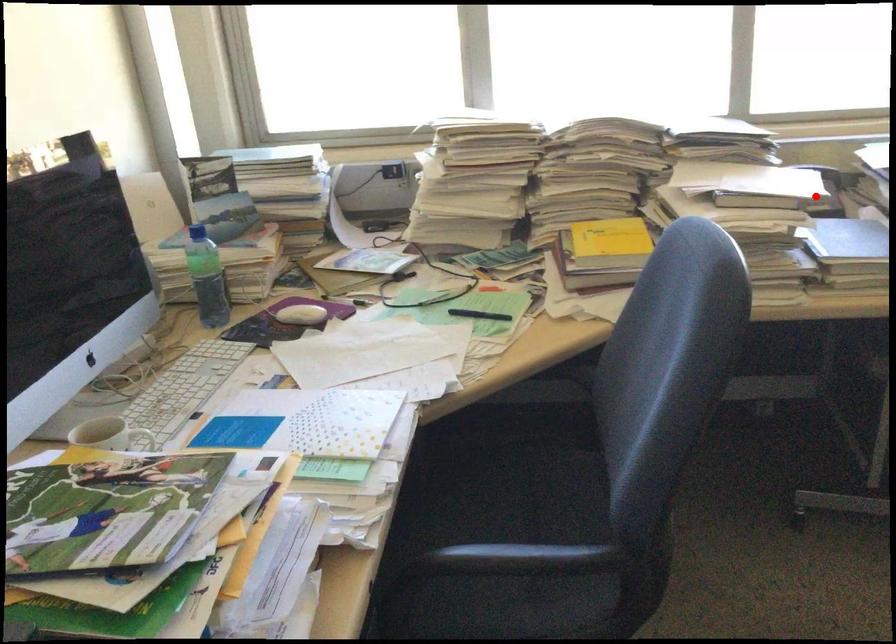
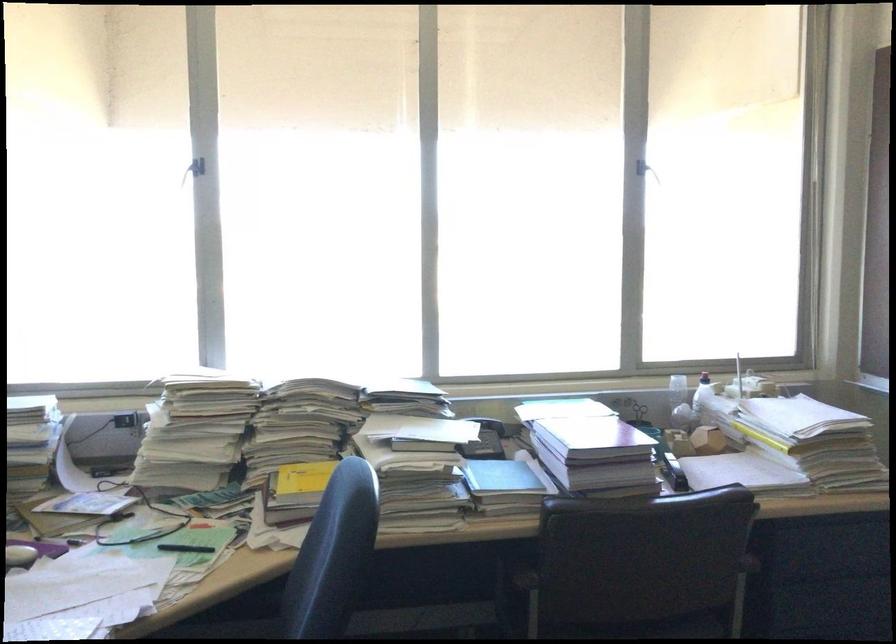
The point at the highlighted location is marked in the first image. Where is the corresponding point in the second image?

(485, 440)